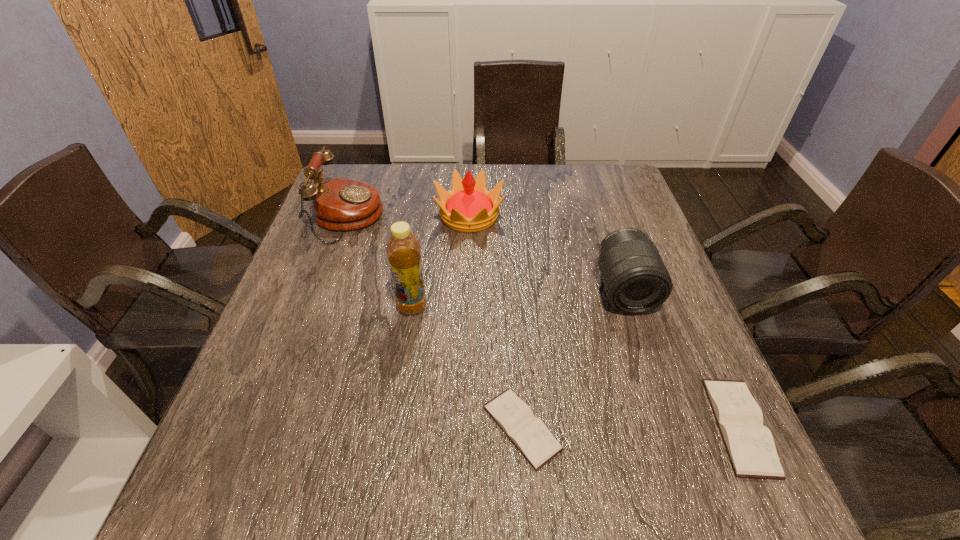
Locate an element on the screen. The image size is (960, 540). the shorter diary is located at coordinates (529, 434).

Find the location of a particular element. The height and width of the screenshot is (540, 960). the shortest object is located at coordinates (529, 434).

Where is `the right diary`? the right diary is located at coordinates (750, 445).

Identify the location of the rightmost object. (750, 445).

The height and width of the screenshot is (540, 960). I want to click on crown, so click(468, 207).

What are the coordinates of `the leftmost object` in the screenshot? It's located at (340, 204).

I want to click on bottle, so click(x=403, y=249).

Where is `telephoto lens`? The width and height of the screenshot is (960, 540). telephoto lens is located at coordinates (635, 279).

Identify the location of vacant space located 0.120m on the right of the shorter diary. Image resolution: width=960 pixels, height=540 pixels. (627, 428).

Identify the location of vacant space located 0.380m on the left of the right diary. The height and width of the screenshot is (540, 960). (504, 426).